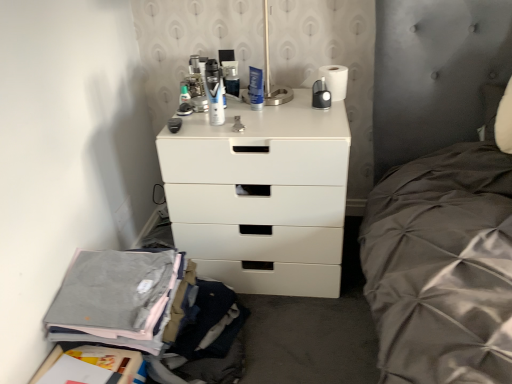
The image size is (512, 384). What are the coordinates of `free space in front of matte black shaving cream can at center, the 2th toiletry in the right-to-left sequence` in the screenshot? It's located at (214, 133).